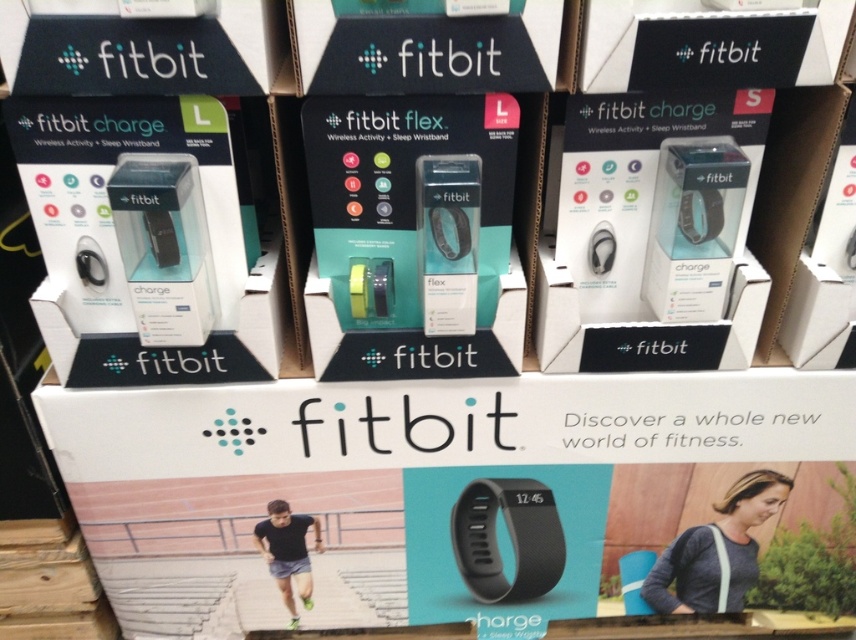
Is matte black box at upper left taller than black matte wristband at center?

Result: Incorrect, matte black box at upper left's height is not larger of black matte wristband at center's.

Is matte black box at upper left below black matte wristband at center?

No.

Does point (134, 88) lie behind point (739, 257)?

That is False.

Identify the location of matte black box at upper left. The width and height of the screenshot is (856, 640). (140, 49).

Who is more distant from viewer, (33,29) or (150,355)?

The point (150,355) is behind.

Does point (206, 92) lie behind point (45, 333)?

No, it is not.

The height and width of the screenshot is (640, 856). What do you see at coordinates (140, 49) in the screenshot?
I see `matte black box at upper left` at bounding box center [140, 49].

Where is `matte black box at upper left`? The width and height of the screenshot is (856, 640). matte black box at upper left is located at coordinates click(x=140, y=49).

Between matte black box at upper left and black matte fitbit box at center, which one appears on the left side from the viewer's perspective?

matte black box at upper left

Where is `matte black box at upper left`? matte black box at upper left is located at coordinates (140, 49).

Where is `matte black box at upper left`? This screenshot has width=856, height=640. matte black box at upper left is located at coordinates (140, 49).